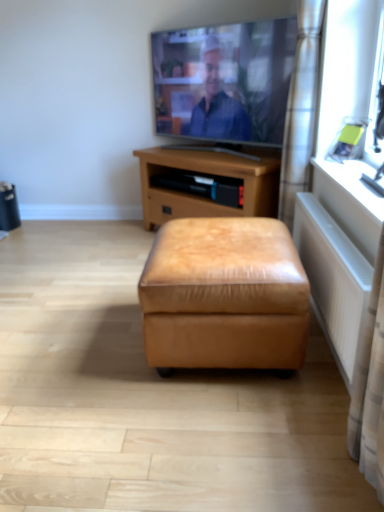
Question: Is matte silver tv at upper center positioned with its back to brown leather ottoman at center?

Choices:
 (A) no
 (B) yes

Answer: (A)

Question: Does matte silver tv at upper center have a smaller size compared to brown leather ottoman at center?

Choices:
 (A) no
 (B) yes

Answer: (B)

Question: Is matte silver tv at upper center not close to brown leather ottoman at center?

Choices:
 (A) yes
 (B) no

Answer: (B)

Question: From the image's perspective, does matte silver tv at upper center appear higher than brown leather ottoman at center?

Choices:
 (A) yes
 (B) no

Answer: (A)

Question: Is matte silver tv at upper center in contact with brown leather ottoman at center?

Choices:
 (A) no
 (B) yes

Answer: (A)

Question: From a real-world perspective, is satin silver curtain at right positioned above or below matte silver tv at upper center?

Choices:
 (A) below
 (B) above

Answer: (A)

Question: Considering their positions, is satin silver curtain at right located in front of or behind matte silver tv at upper center?

Choices:
 (A) front
 (B) behind

Answer: (A)

Question: Would you say satin silver curtain at right is to the left or to the right of matte silver tv at upper center in the picture?

Choices:
 (A) left
 (B) right

Answer: (B)

Question: Looking at the image, does satin silver curtain at right seem bigger or smaller compared to matte silver tv at upper center?

Choices:
 (A) big
 (B) small

Answer: (B)

Question: From the image's perspective, relative to tan leather ottoman at center, is brown leather ottoman at center above or below?

Choices:
 (A) above
 (B) below

Answer: (A)

Question: Is brown leather ottoman at center to the left or to the right of tan leather ottoman at center in the image?

Choices:
 (A) left
 (B) right

Answer: (A)

Question: Is point (266, 200) closer or farther from the camera than point (276, 282)?

Choices:
 (A) closer
 (B) farther

Answer: (B)

Question: From a real-world perspective, is brown leather ottoman at center positioned above or below tan leather ottoman at center?

Choices:
 (A) above
 (B) below

Answer: (A)

Question: In terms of width, does white plastic window sill at right look wider or thinner when compared to satin silver curtain at right?

Choices:
 (A) wide
 (B) thin

Answer: (A)

Question: Visually, is white plastic window sill at right positioned to the left or to the right of satin silver curtain at right?

Choices:
 (A) left
 (B) right

Answer: (B)